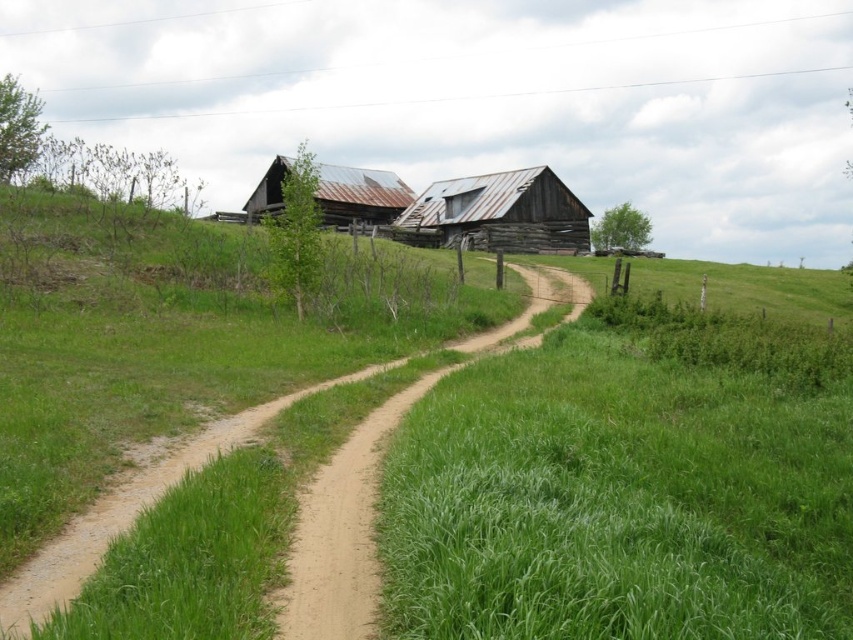
Question: Does weathered wood hut at center lie behind rusty metal barn at center?

Choices:
 (A) yes
 (B) no

Answer: (A)

Question: Which object is positioned closest to the dirt path at center?

Choices:
 (A) green grassy at center
 (B) weathered wood hut at center

Answer: (A)

Question: Which of the following is the farthest from the observer?

Choices:
 (A) (577, 250)
 (B) (357, 406)
 (C) (303, 509)
 (D) (367, 180)

Answer: (D)

Question: Among these objects, which one is farthest from the camera?

Choices:
 (A) weathered wood hut at center
 (B) dirt path at center
 (C) rusty metal barn at center
 (D) green grassy at center

Answer: (A)

Question: Does weathered wood hut at center have a larger size compared to rusty metal barn at center?

Choices:
 (A) no
 (B) yes

Answer: (A)

Question: Can you confirm if green grassy at center is positioned to the left of rusty metal barn at center?

Choices:
 (A) yes
 (B) no

Answer: (B)